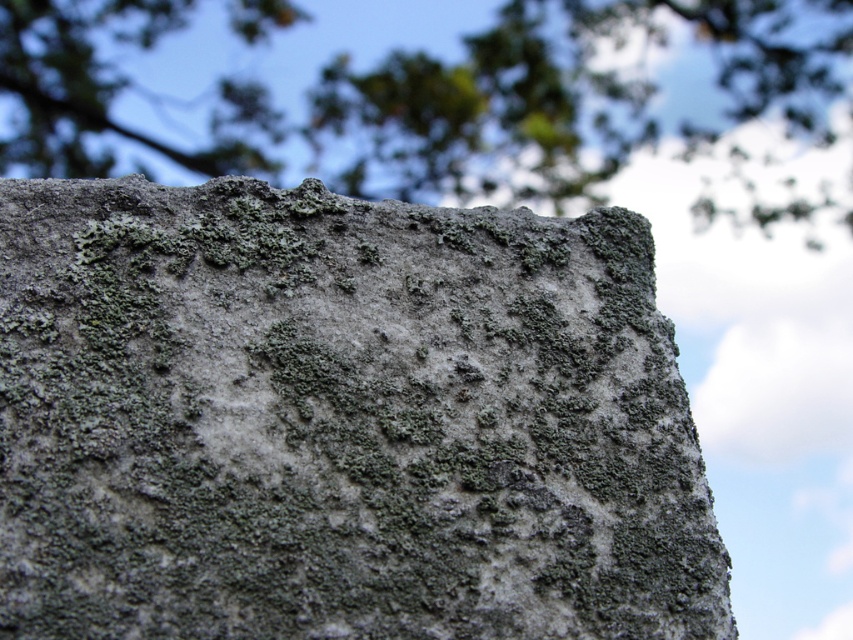
You are a hiker carrying a backpack weighing 15 kilograms. You need to cross a rocky path where the gray rough stone at upper center and the green mossy rock at upper center are the only stable points. Can you safely step from one to the other without slipping?

The distance between the gray rough stone at upper center and the green mossy rock at upper center is 3.69 meters. Since the average person can jump about 2 meters, the gap is too wide to safely cross without slipping. You should look for another path or stable rocks closer together.

You are standing 5 feet away from the stone surface. If you move forward 1.5 feet, will the point at coordinates point (550, 428) become closer than 2 feet from you?

The distance of point (550, 428) from viewer is 3.48 feet. After moving forward 1.5 feet, the new distance is 3.48 minus 1.5 equals 1.98 feet, which is less than 2 feet. Therefore, yes, the point at coordinates point (550, 428) will be closer than 2 feet from you.

You are examining the stone surface and want to determine which of the two points, point (450, 321) or point (300, 19), is nearer to your viewpoint. Based on the image, which point is closer?

Point (450, 321) is closer to the camera than point (300, 19).